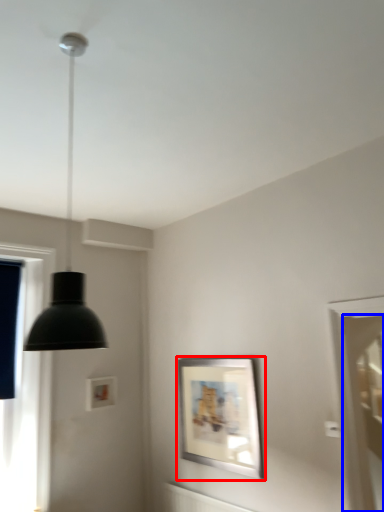
Question: Which point is further to the camera, picture frame (highlighted by a red box) or screen door (highlighted by a blue box)?

Choices:
 (A) picture frame
 (B) screen door

Answer: (B)